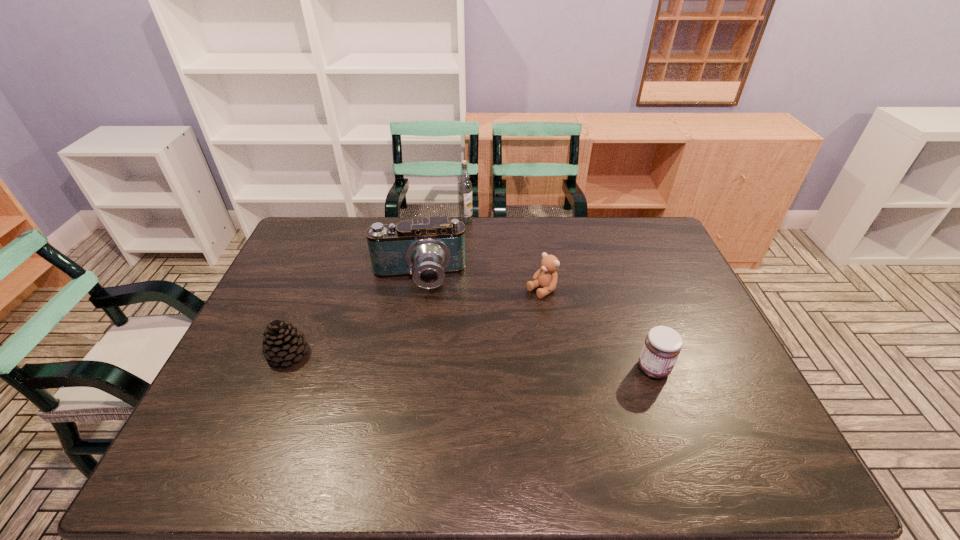
Locate an element on the screen. The height and width of the screenshot is (540, 960). vacant position located on the front-facing side of the teddy bear is located at coordinates (430, 359).

Find the location of `free point located on the label of the tallest object`. free point located on the label of the tallest object is located at coordinates (473, 253).

Find the location of `vacant space situated 0.380m on the label of the tallest object`. vacant space situated 0.380m on the label of the tallest object is located at coordinates (482, 293).

Image resolution: width=960 pixels, height=540 pixels. In order to click on vacant space located on the label of the tallest object in this screenshot , I will do `click(472, 248)`.

The image size is (960, 540). I want to click on blank area located 0.190m on the front-facing side of the camcorder, so click(420, 346).

Locate an element on the screen. The height and width of the screenshot is (540, 960). vacant space located 0.310m on the front-facing side of the camcorder is located at coordinates (420, 383).

What are the coordinates of `free space located 0.210m on the front-facing side of the camcorder` in the screenshot? It's located at (420, 352).

Identify the location of object at the far edge. Image resolution: width=960 pixels, height=540 pixels. (464, 185).

Image resolution: width=960 pixels, height=540 pixels. What are the coordinates of `object present at the left edge` in the screenshot? It's located at (282, 343).

You are a GUI agent. You are given a task and a screenshot of the screen. Output one action in this format:
    pyautogui.click(x=<x>, y=<y>)
    Task: Click on the vacant space at the far edge of the desktop
    This screenshot has width=960, height=540.
    Given the screenshot: What is the action you would take?
    pyautogui.click(x=369, y=252)